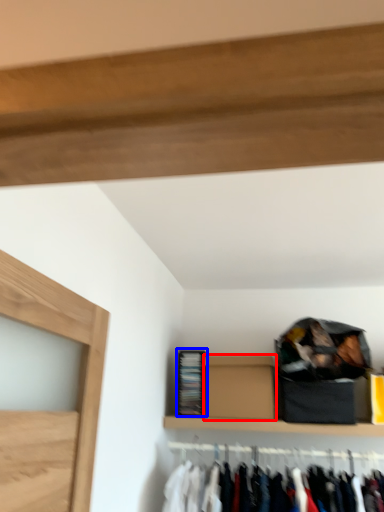
Question: Which object is further to the camera taking this photo, box (highlighted by a red box) or cabinet (highlighted by a blue box)?

Choices:
 (A) box
 (B) cabinet

Answer: (B)